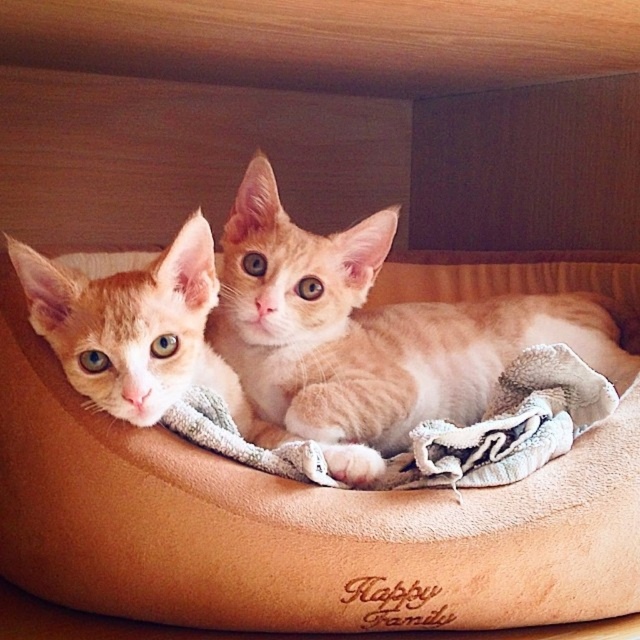
Question: Among these points, which one is farthest from the camera?

Choices:
 (A) (582, 304)
 (B) (52, 360)
 (C) (509, 412)

Answer: (A)

Question: Can you confirm if orange fur kitten at left is positioned to the right of gray terry cloth blanket at center?

Choices:
 (A) yes
 (B) no

Answer: (B)

Question: Estimate the real-world distances between objects in this image. Which object is closer to the gray terry cloth blanket at center?

Choices:
 (A) orange fur kitten at left
 (B) orange fur cat at center

Answer: (B)

Question: Among these objects, which one is nearest to the camera?

Choices:
 (A) orange fur cat at center
 (B) beige suede cat bed at center
 (C) orange fur kitten at left

Answer: (C)

Question: Does orange fur kitten at left have a greater width compared to gray terry cloth blanket at center?

Choices:
 (A) yes
 (B) no

Answer: (B)

Question: Can you confirm if orange fur cat at center is positioned to the right of gray terry cloth blanket at center?

Choices:
 (A) no
 (B) yes

Answer: (B)